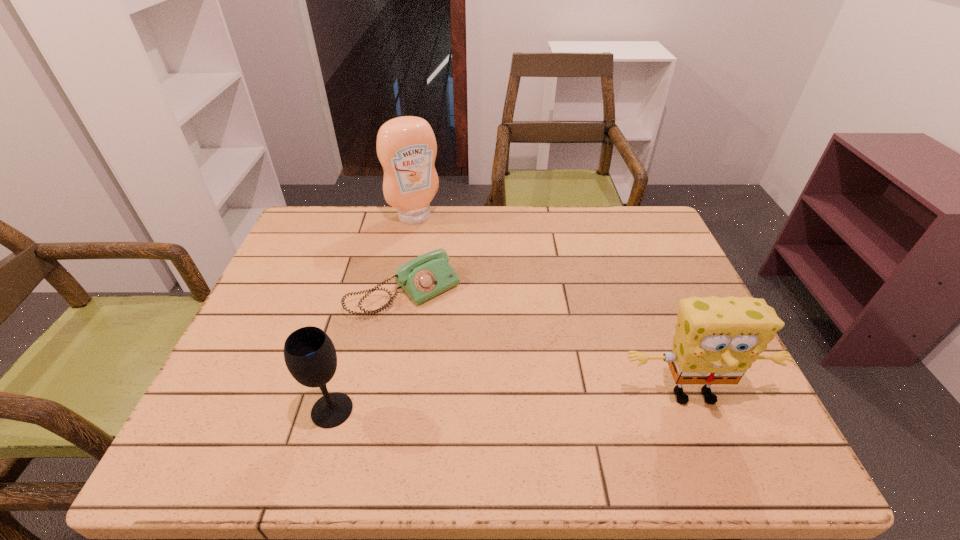
The image size is (960, 540). Identify the location of vacant area that lies between the shortest object and the rightmost object. (549, 343).

The image size is (960, 540). I want to click on empty space between the sponge and the wineglass, so click(x=513, y=402).

I want to click on free space between the farthest object and the wineglass, so click(x=373, y=313).

I want to click on object that is the closest to the second farthest object, so click(x=406, y=146).

Find the location of a particular element. The image size is (960, 540). the third closest object relative to the telephone is located at coordinates (716, 340).

At what (x,y) coordinates should I click in order to perform the action: click on vacant space that satisfies the following two spatial constraints: 1. on the front side of the second farthest object; 2. on the left side of the tallest object. Please return your answer as a coordinate pair (x, y). This screenshot has width=960, height=540. Looking at the image, I should click on (400, 292).